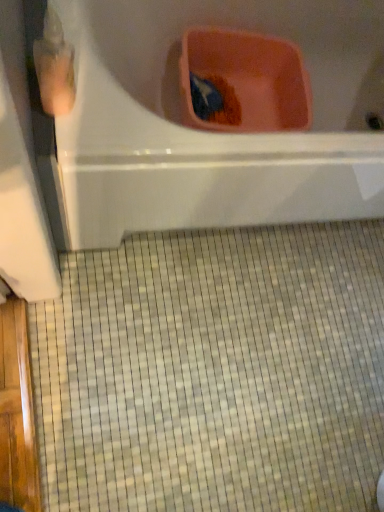
Where is `white glossy bathtub at upper center`? The height and width of the screenshot is (512, 384). white glossy bathtub at upper center is located at coordinates coord(215,132).

Measure the distance between point (373, 6) and camera.

4.42 feet.

The width and height of the screenshot is (384, 512). Describe the element at coordinates (215, 132) in the screenshot. I see `white glossy bathtub at upper center` at that location.

The width and height of the screenshot is (384, 512). Identify the location of white glossy bathtub at upper center. (215, 132).